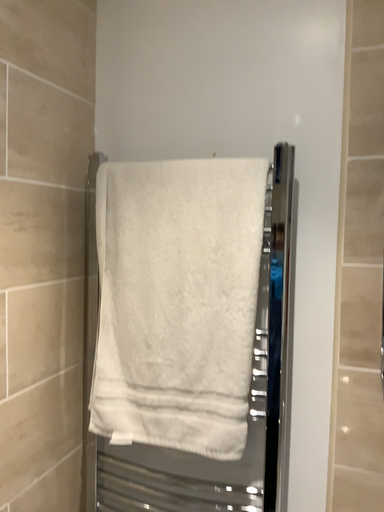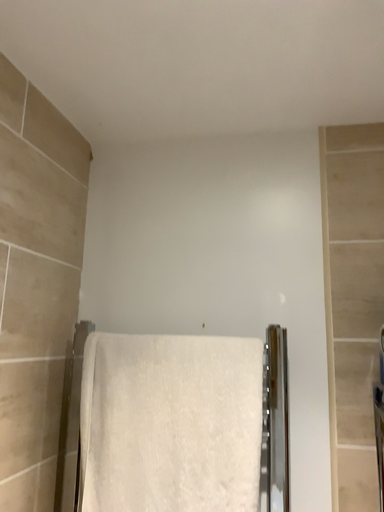
Question: How did the camera likely rotate when shooting the video?

Choices:
 (A) rotated downward
 (B) rotated upward

Answer: (B)